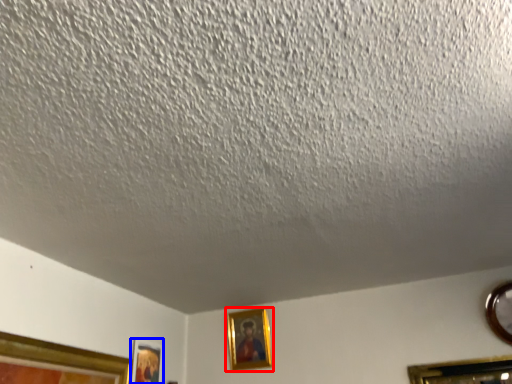
Question: Among these objects, which one is nearest to the camera, picture frame (highlighted by a red box) or picture frame (highlighted by a blue box)?

Choices:
 (A) picture frame
 (B) picture frame

Answer: (B)